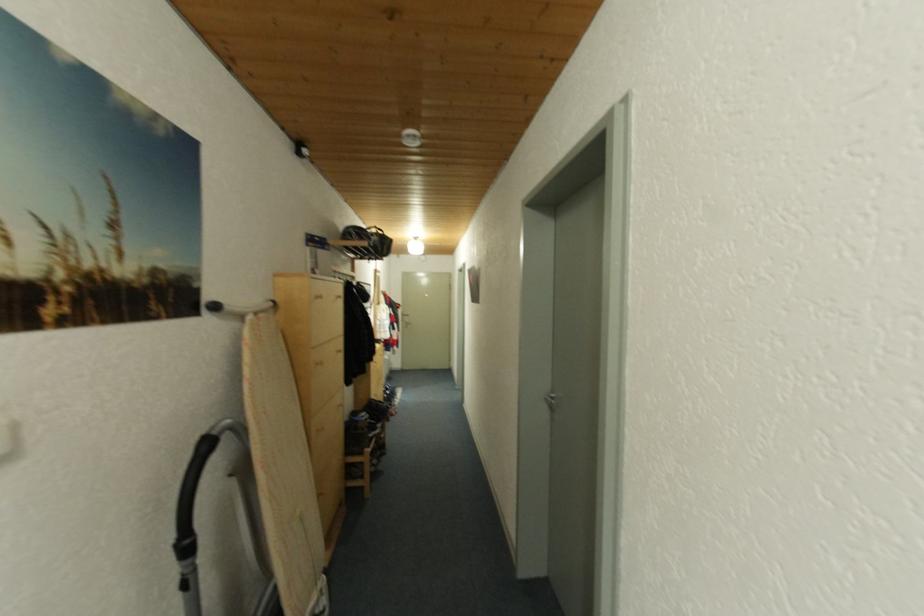
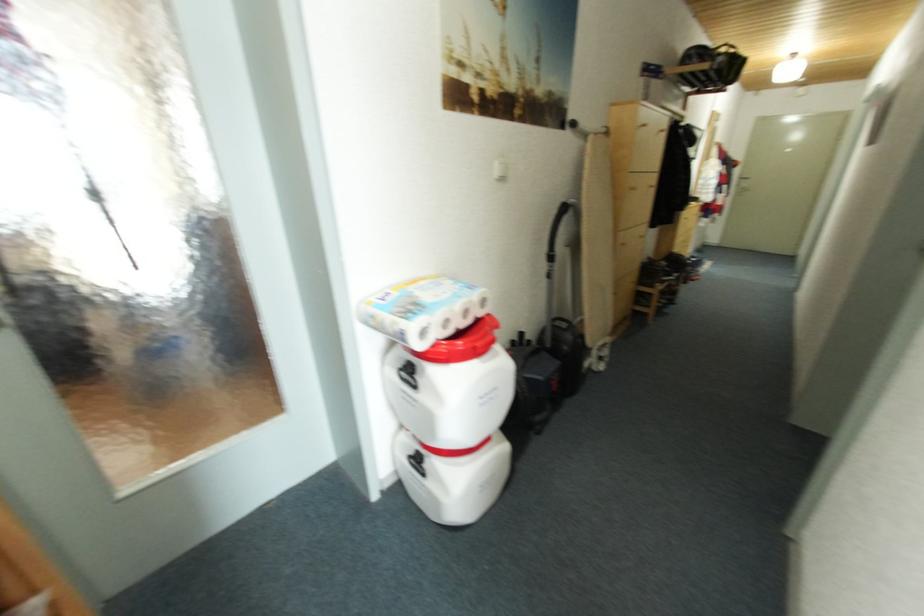
The first image is from the beginning of the video and the second image is from the end. How did the camera likely rotate when shooting the video?

The camera rotated toward left-down.